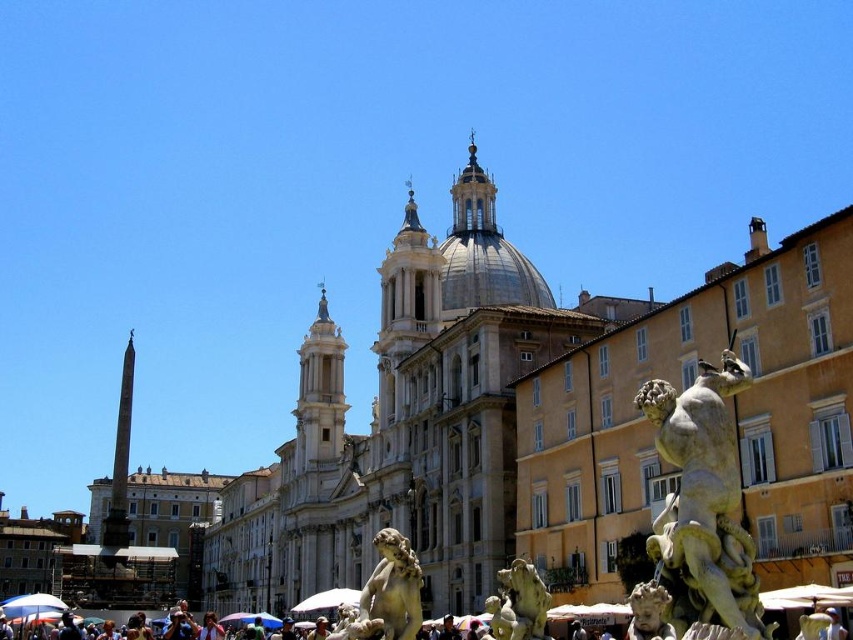
Consider the image. Who is lower down, white marble statue at lower right or white marble cherub at lower right?

white marble cherub at lower right is below.

Is white marble statue at lower right taller than white marble cherub at lower right?

Yes.

This screenshot has width=853, height=640. Describe the element at coordinates (703, 502) in the screenshot. I see `white marble statue at lower right` at that location.

At what (x,y) coordinates should I click in order to perform the action: click on white marble statue at lower right. Please return your answer as a coordinate pair (x, y). Looking at the image, I should click on (703, 502).

Based on the photo, which is above, white marble statue at center or green marble statue at lower right?

green marble statue at lower right

Is point (384, 595) positioned in front of point (502, 625)?

Yes, it is.

The height and width of the screenshot is (640, 853). What do you see at coordinates (389, 593) in the screenshot?
I see `white marble statue at center` at bounding box center [389, 593].

You are a GUI agent. You are given a task and a screenshot of the screen. Output one action in this format:
    pyautogui.click(x=<x>, y=<y>)
    Task: Click on the white marble statue at center
    The image size is (853, 640).
    Given the screenshot: What is the action you would take?
    pyautogui.click(x=389, y=593)

Between white marble statue at center and white marble cherub at lower right, which one has more height?

Standing taller between the two is white marble statue at center.

Which is more to the left, white marble statue at center or white marble cherub at lower right?

white marble statue at center

The image size is (853, 640). What do you see at coordinates (389, 593) in the screenshot? I see `white marble statue at center` at bounding box center [389, 593].

Find the location of `white marble statue at center`. white marble statue at center is located at coordinates (389, 593).